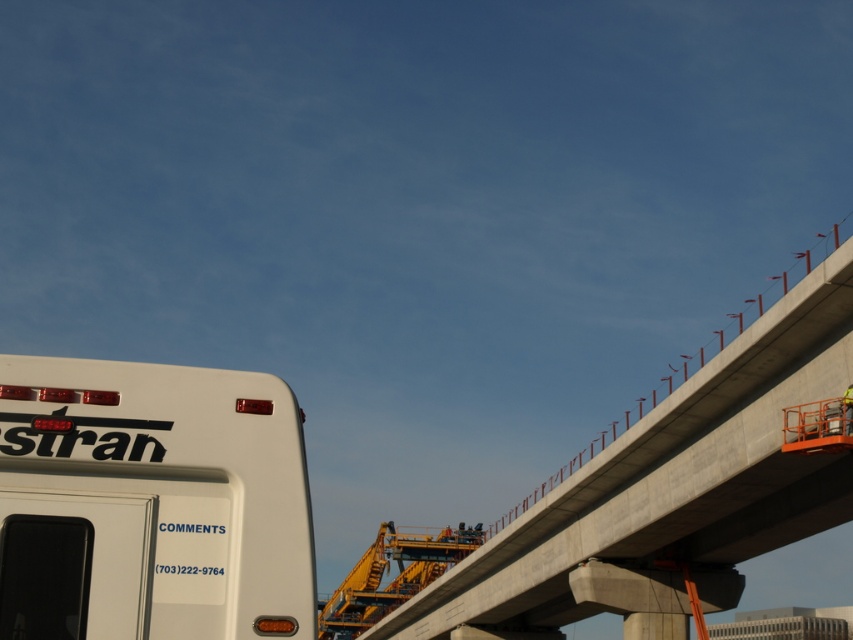
Is white matte bus at lower left thinner than concrete at upper right?

Yes, white matte bus at lower left is thinner than concrete at upper right.

Which is below, white matte bus at lower left or concrete at upper right?

Positioned lower is concrete at upper right.

Between point (202, 448) and point (775, 332), which one is positioned behind?

Point (775, 332)

You are a GUI agent. You are given a task and a screenshot of the screen. Output one action in this format:
    pyautogui.click(x=<x>, y=<y>)
    Task: Click on the white matte bus at lower left
    Image resolution: width=853 pixels, height=640 pixels.
    Given the screenshot: What is the action you would take?
    pyautogui.click(x=149, y=502)